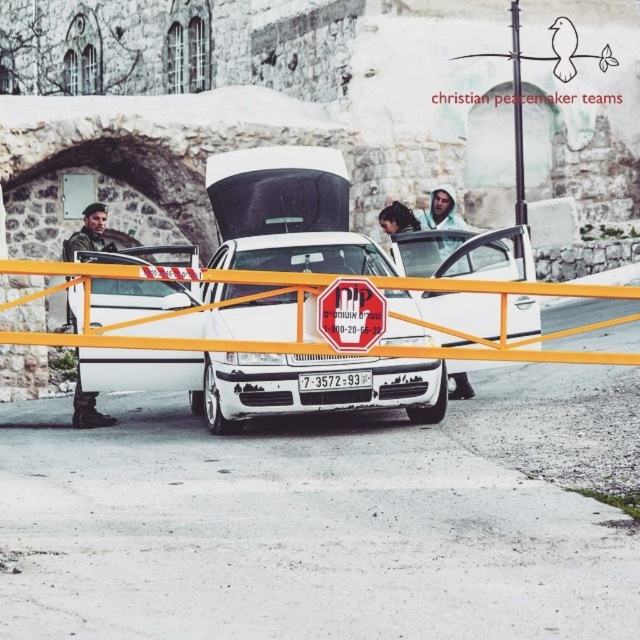
You are a pedestrian trying to cross the road where the red plastic stop sign at center and camouflage fabric uniform at center are located. The safe distance for crossing is at least 15 meters. Can you safely cross between these two objects?

The red plastic stop sign at center is 13.95 meters from the camouflage fabric uniform at center. Since the safe distance for crossing is at least 15 meters, you cannot safely cross between them as the distance is less than required.

You are a pedestrian standing on the sidewalk and see the white glossy car at center and the white plastic license plate at center. Which object is closer to you?

The white glossy car at center is closer to you than the white plastic license plate at center.

You are a delivery person trying to park your vehicle in the area shown. You notice the white glossy car at center and the white plastic license plate at center. Based on their positions, which object is closer to the ground?

The white plastic license plate at center is closer to the ground because the white glossy car at center is located above it.